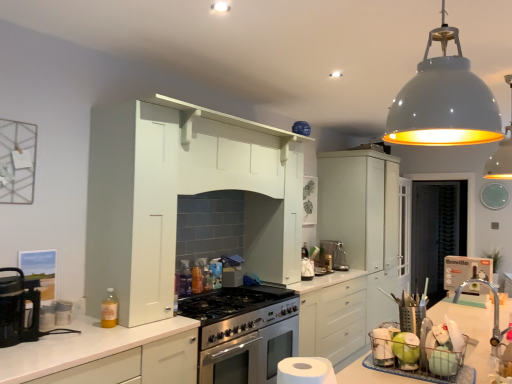
This screenshot has height=384, width=512. I want to click on spots to the right of translucent yellow bottle at lower left, so click(x=136, y=318).